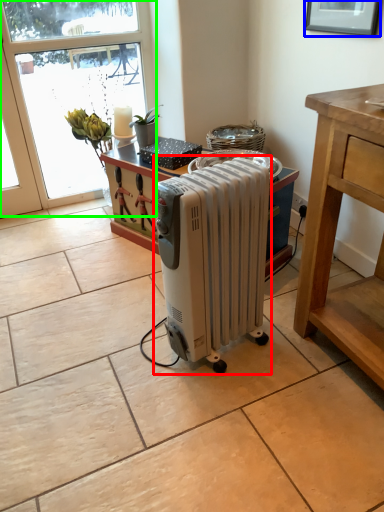
Question: Considering the real-world distances, which object is closest to home appliance (highlighted by a red box)? picture frame (highlighted by a blue box) or window (highlighted by a green box).

Choices:
 (A) picture frame
 (B) window

Answer: (A)